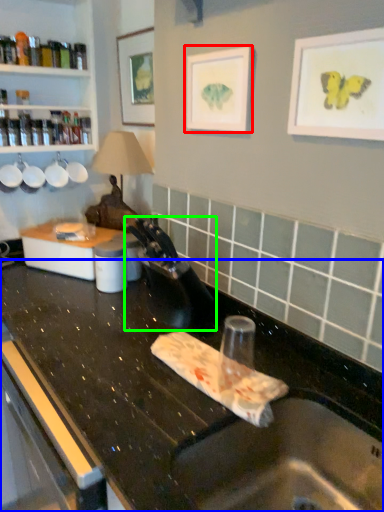
Question: Which object is positioned farthest from picture frame (highlighted by a red box)? Select from countertop (highlighted by a blue box) and faucet (highlighted by a green box).

Choices:
 (A) countertop
 (B) faucet

Answer: (A)